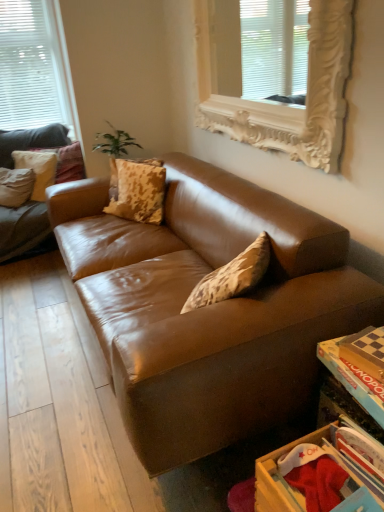
Find the location of `matte beige pillow at upper left, which is counted as the third pillow, starting from the front`. matte beige pillow at upper left, which is counted as the third pillow, starting from the front is located at coordinates (67, 162).

This screenshot has height=512, width=384. I want to click on white ornate frame at upper center, which appears as the 2th window when viewed from the back, so click(277, 104).

What are the coordinates of `wooden monopoly board at lower right` in the screenshot? It's located at (356, 388).

Locate an element on the screen. The height and width of the screenshot is (512, 384). green leafy plant at upper left is located at coordinates (114, 152).

Describe the element at coordinates (114, 152) in the screenshot. I see `green leafy plant at upper left` at that location.

At what (x,y) coordinates should I click in order to perform the action: click on white matte window at upper left, which appears as the first window when viewed from the left. Please return your answer as a coordinate pair (x, y). This screenshot has width=384, height=512. Looking at the image, I should click on (35, 67).

Describe the element at coordinates (38, 169) in the screenshot. I see `matte brown pillow at upper left, which ranks as the 3th pillow in right-to-left order` at that location.

This screenshot has width=384, height=512. In order to click on matte beige pillow at upper left, arranged as the second pillow when viewed from the left in this screenshot , I will do `click(67, 162)`.

Does wooden monopoly board at lower right turn towards brown leather couch at left?

No.

The height and width of the screenshot is (512, 384). I want to click on studio couch that is in front of the wooden monopoly board at lower right, so click(208, 307).

Which of these two, wooden monopoly board at lower right or brown leather couch at left, is thinner?

wooden monopoly board at lower right.

Is wooden monopoly board at lower right to the left or to the right of brown leather couch at left in the image?

In the image, wooden monopoly board at lower right appears on the right side of brown leather couch at left.

From the image's perspective, is brown leather couch at left located above or below camouflage-patterned pillow at center, which is the third pillow from back to front?

Clearly, from the image's perspective, brown leather couch at left is below camouflage-patterned pillow at center, which is the third pillow from back to front.

Considering the points (302, 349) and (121, 183), which point is behind, point (302, 349) or point (121, 183)?

The point (121, 183) is farther from the camera.

Looking at this image, which is correct: brown leather couch at left is inside camouflage-patterned pillow at center, the 1th pillow positioned from the front, or outside of it?

brown leather couch at left is not inside camouflage-patterned pillow at center, the 1th pillow positioned from the front, it's outside.

Is brown leather couch at left not close to camouflage-patterned pillow at center, which is the third pillow from back to front?

No, brown leather couch at left is in close proximity to camouflage-patterned pillow at center, which is the third pillow from back to front.

Can you confirm if white ornate frame at upper center, which is counted as the 1th window, starting from the right, is smaller than green leafy plant at upper left?

Incorrect, white ornate frame at upper center, which is counted as the 1th window, starting from the right, is not smaller in size than green leafy plant at upper left.

In the image, is white ornate frame at upper center, arranged as the 2th window when viewed from the left, on the left side or the right side of green leafy plant at upper left?

From the image, it's evident that white ornate frame at upper center, arranged as the 2th window when viewed from the left, is to the right of green leafy plant at upper left.

You are a GUI agent. You are given a task and a screenshot of the screen. Output one action in this format:
    pyautogui.click(x=<x>, y=<y>)
    Task: Click on the plant below the white ornate frame at upper center, arranged as the 2th window when viewed from the left (from the image's perspective)
    
    Given the screenshot: What is the action you would take?
    pyautogui.click(x=114, y=152)

Which is behind, point (266, 358) or point (115, 194)?

The point (115, 194) is behind.

Does brown leather couch at left turn towards green leafy plant at upper left?

No, brown leather couch at left is not oriented towards green leafy plant at upper left.

Are brown leather couch at left and green leafy plant at upper left located far from each other?

Yes, brown leather couch at left is far from green leafy plant at upper left.

Considering the positions of objects camouflage-patterned pillow at center, which is the third pillow from back to front, and brown leather couch at left in the image provided, who is more to the right, camouflage-patterned pillow at center, which is the third pillow from back to front, or brown leather couch at left?

From the viewer's perspective, brown leather couch at left appears more on the right side.

Is brown leather couch at left surrounded by camouflage-patterned pillow at center, which is the third pillow from back to front?

That's incorrect, brown leather couch at left is not inside camouflage-patterned pillow at center, which is the third pillow from back to front.

Which of these two, camouflage-patterned pillow at center, which is the third pillow from back to front, or brown leather couch at left, stands taller?

brown leather couch at left is taller.

What's the angular difference between camouflage-patterned pillow at center, which is the third pillow from back to front, and brown leather couch at left's facing directions?

The facing directions of camouflage-patterned pillow at center, which is the third pillow from back to front, and brown leather couch at left are 31.8 degrees apart.

Which is more to the left, wooden drawer at lower right or white ornate frame at upper center, which is counted as the 1th window, starting from the right?

white ornate frame at upper center, which is counted as the 1th window, starting from the right.

From the image's perspective, is wooden drawer at lower right on white ornate frame at upper center, which is counted as the 1th window, starting from the right?

No.

Could you tell me if wooden drawer at lower right is facing white ornate frame at upper center, which is the first window from front to back?

No, wooden drawer at lower right does not turn towards white ornate frame at upper center, which is the first window from front to back.

Is the surface of wooden drawer at lower right in direct contact with white ornate frame at upper center, which is the first window from front to back?

No, wooden drawer at lower right is not with white ornate frame at upper center, which is the first window from front to back.

Could you tell me if matte beige pillow at upper left, which is counted as the third pillow, starting from the front, is turned towards green leafy plant at upper left?

No, matte beige pillow at upper left, which is counted as the third pillow, starting from the front, is not oriented towards green leafy plant at upper left.

Looking at this image, considering their positions, is matte beige pillow at upper left, arranged as the second pillow when viewed from the left, located in front of or behind green leafy plant at upper left?

Clearly, matte beige pillow at upper left, arranged as the second pillow when viewed from the left, is behind green leafy plant at upper left.

Find the location of a particular element. table above the brown leather couch at left (from a real-world perspective) is located at coordinates (356, 388).

The width and height of the screenshot is (384, 512). What are the coordinates of `studio couch below the camouflage-patterned pillow at center, placed as the 1th pillow when sorted from right to left (from the image's perspective)` in the screenshot? It's located at (208, 307).

Which object lies nearer to the anchor point matte brown pillow at upper left, acting as the second pillow starting from the front, wooden monopoly board at lower right or white matte window at upper left, which appears as the first window when viewed from the left?

Among the two, white matte window at upper left, which appears as the first window when viewed from the left, is located nearer to matte brown pillow at upper left, acting as the second pillow starting from the front.

Based on their spatial positions, is white matte window at upper left, marked as the 2th window in a right-to-left arrangement, or wooden drawer at lower right further from camouflage-patterned pillow at center, which is the third pillow from back to front?

wooden drawer at lower right is positioned further to the anchor camouflage-patterned pillow at center, which is the third pillow from back to front.

Estimate the real-world distances between objects in this image. Which object is further from matte beige pillow at upper left, arranged as the 2th pillow when viewed from the right, green leafy plant at upper left or wooden monopoly board at lower right?

wooden monopoly board at lower right is positioned further to the anchor matte beige pillow at upper left, arranged as the 2th pillow when viewed from the right.

Looking at the image, which one is located further to matte beige pillow at upper left, which is counted as the third pillow, starting from the front, wooden drawer at lower right or camouflage-patterned pillow at center, placed as the 1th pillow when sorted from right to left?

wooden drawer at lower right.

Considering their positions, is matte brown pillow at upper left, which is the first pillow in left-to-right order, positioned closer to brown leather couch at left than white ornate frame at upper center, which is the first window from front to back?

white ornate frame at upper center, which is the first window from front to back, is positioned closer to the anchor brown leather couch at left.

Considering their positions, is matte beige pillow at upper left, arranged as the second pillow when viewed from the left, positioned closer to brown leather couch at left than white ornate frame at upper center, arranged as the 2th window when viewed from the left?

white ornate frame at upper center, arranged as the 2th window when viewed from the left, is positioned closer to the anchor brown leather couch at left.

From the image, which object appears to be nearer to camouflage-patterned pillow at center, which is the third pillow from back to front, wooden drawer at lower right or white matte window at upper left, which appears as the first window when viewed from the left?

Based on the image, white matte window at upper left, which appears as the first window when viewed from the left, appears to be nearer to camouflage-patterned pillow at center, which is the third pillow from back to front.

Consider the image. From the image, which object appears to be nearer to white ornate frame at upper center, which is counted as the 1th window, starting from the right, white matte window at upper left, which appears as the first window when viewed from the left, or camouflage-patterned pillow at center, the 3th pillow from the left?

The object closer to white ornate frame at upper center, which is counted as the 1th window, starting from the right, is camouflage-patterned pillow at center, the 3th pillow from the left.

Find the location of `window between wooden monopoly board at lower right and matte brown pillow at upper left, which is the first pillow in left-to-right order, in the front-back direction`. window between wooden monopoly board at lower right and matte brown pillow at upper left, which is the first pillow in left-to-right order, in the front-back direction is located at coordinates click(277, 104).

Identify the location of table located between brown leather couch at left and camouflage-patterned pillow at center, placed as the 1th pillow when sorted from right to left, in the depth direction. The width and height of the screenshot is (384, 512). (356, 388).

This screenshot has width=384, height=512. I want to click on window between wooden drawer at lower right and white matte window at upper left, which appears as the first window when viewed from the left, from front to back, so click(277, 104).

Where is `plant located between brown leather couch at left and matte beige pillow at upper left, which is counted as the third pillow, starting from the front, in the depth direction`? This screenshot has width=384, height=512. plant located between brown leather couch at left and matte beige pillow at upper left, which is counted as the third pillow, starting from the front, in the depth direction is located at coordinates (114, 152).